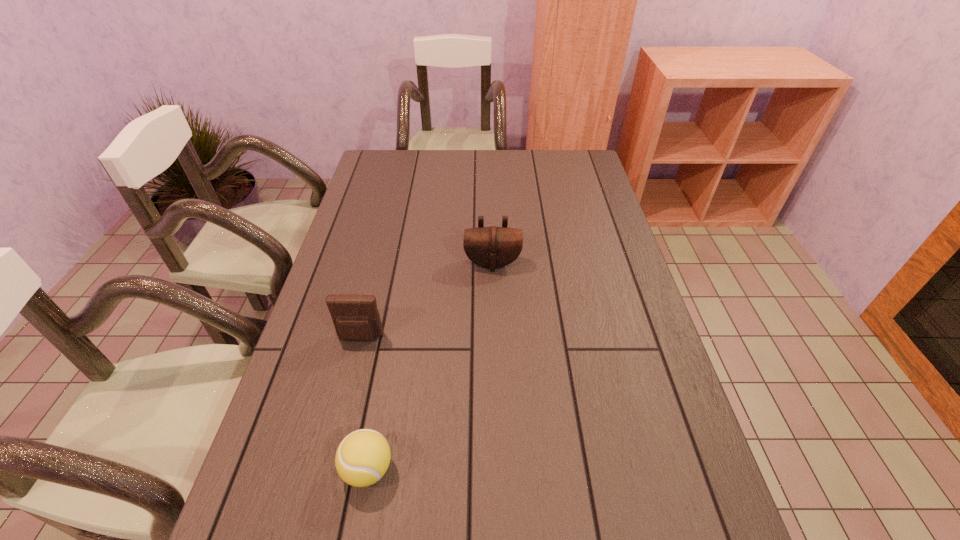
At what (x,y) coordinates should I click in order to perform the action: click on vacant position at the far edge of the desktop. Please return your answer as a coordinate pair (x, y). Image resolution: width=960 pixels, height=540 pixels. Looking at the image, I should click on (491, 167).

Image resolution: width=960 pixels, height=540 pixels. In the image, there is a desktop. Identify the location of blank space at the left edge. (322, 291).

Where is `blank space at the right edge`? blank space at the right edge is located at coordinates (638, 348).

Locate an element on the screen. free space at the far right corner of the desktop is located at coordinates (588, 176).

You are a GUI agent. You are given a task and a screenshot of the screen. Output one action in this format:
    pyautogui.click(x=<x>, y=<y>)
    Task: Click on the empty space that is in between the left pouch and the tennis ball
    
    Given the screenshot: What is the action you would take?
    pyautogui.click(x=364, y=403)

Where is `vacant area that lies between the right pouch and the shortest object`? Image resolution: width=960 pixels, height=540 pixels. vacant area that lies between the right pouch and the shortest object is located at coordinates (430, 366).

Image resolution: width=960 pixels, height=540 pixels. What are the coordinates of `blank region between the farthest object and the shortest object` in the screenshot? It's located at (430, 366).

You are a GUI agent. You are given a task and a screenshot of the screen. Output one action in this format:
    pyautogui.click(x=<x>, y=<y>)
    Task: Click on the unoccupied area between the left pouch and the rightmost object
    The width and height of the screenshot is (960, 540).
    Given the screenshot: What is the action you would take?
    pyautogui.click(x=426, y=301)

You are a GUI agent. You are given a task and a screenshot of the screen. Output one action in this format:
    pyautogui.click(x=<x>, y=<y>)
    Task: Click on the empty space that is in between the nearer pouch and the farthest object
    
    Given the screenshot: What is the action you would take?
    pyautogui.click(x=426, y=301)

Identify the location of empty space that is in between the shortest object and the rightmost object. pos(430,366).